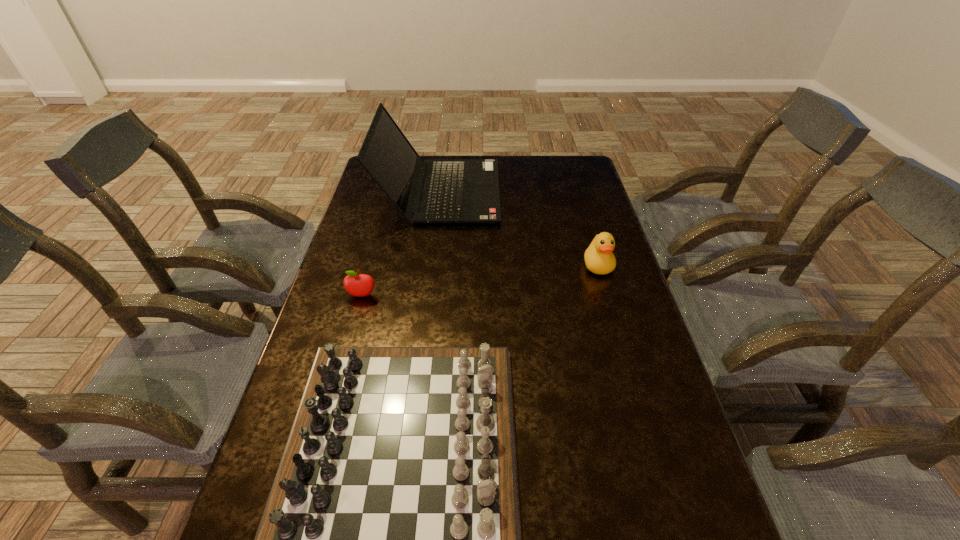
Where is `the tallest object`? The image size is (960, 540). the tallest object is located at coordinates point(455,190).

Identify the location of the farthest object. (455, 190).

At what (x,y) coordinates should I click in order to perform the action: click on the rightmost object. Please return your answer as a coordinate pair (x, y). Looking at the image, I should click on (599, 259).

Locate an element on the screen. The width and height of the screenshot is (960, 540). duck is located at coordinates pos(599,259).

Identify the location of apple. click(x=359, y=285).

Where is `the shortest object`? The image size is (960, 540). the shortest object is located at coordinates (359, 285).

Find the location of a particular element. vacant space located on the screen of the tallest object is located at coordinates (531, 192).

Identify the location of vacant space located 0.130m at the beak of the second farthest object. This screenshot has height=540, width=960. (612, 312).

Where is `vacant space located on the back of the third farthest object`? This screenshot has height=540, width=960. vacant space located on the back of the third farthest object is located at coordinates (371, 266).

The image size is (960, 540). What are the coordinates of `object at the far edge` in the screenshot? It's located at (455, 190).